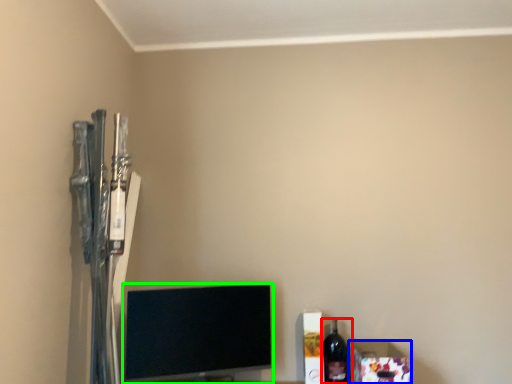
Question: Which object is the farthest from bottle (highlighted by a red box)? Choose among these: box (highlighted by a blue box) or television (highlighted by a green box).

Choices:
 (A) box
 (B) television

Answer: (B)